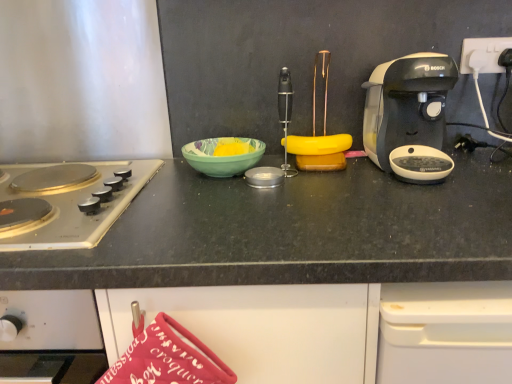
Locate an element on the screen. The width and height of the screenshot is (512, 384). free spot above green glossy bowl at center (from a real-world perspective) is located at coordinates (221, 143).